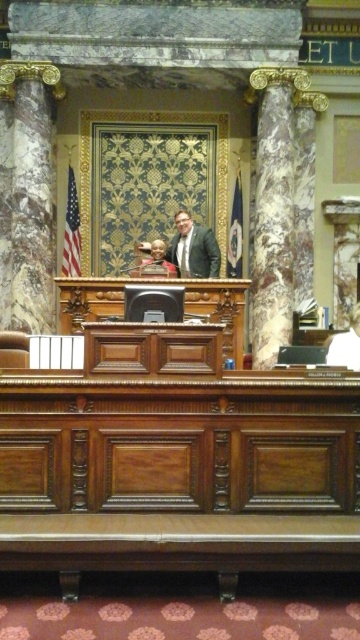
You are an attendee at a formal event in this chamber and need to move from your seat to the podium at the front. There is a marble column at right and a matte black suit at center in your path. Can you walk directly between them without any obstruction?

The marble column at right is positioned over the matte black suit at center, meaning the column is directly above the suit. Since the column is above, there is no physical obstruction blocking the path between them, so you can walk directly between them without any issue.

You are a photographer setting up equipment in the legislative chamber. You need to position a wide camera tripod that requires 2 meters of space between objects. Given the marble column at right and the matte black suit at center, which object should you avoid placing the tripod near to ensure enough space?

The marble column at right has a lesser width compared to the matte black suit at center. Therefore, you should avoid placing the tripod near the matte black suit at center since it occupies more space, leaving less room for the tripod.

You are a photographer positioned at the back of the chamber. You want to take a photo that includes both the marble column at right and the matte black suit at center. Which object should you adjust your camera angle to focus on first to ensure both are in frame?

The marble column at right is closer to the viewer than the matte black suit at center, so you should focus on the marble column at right first to ensure both are in frame.